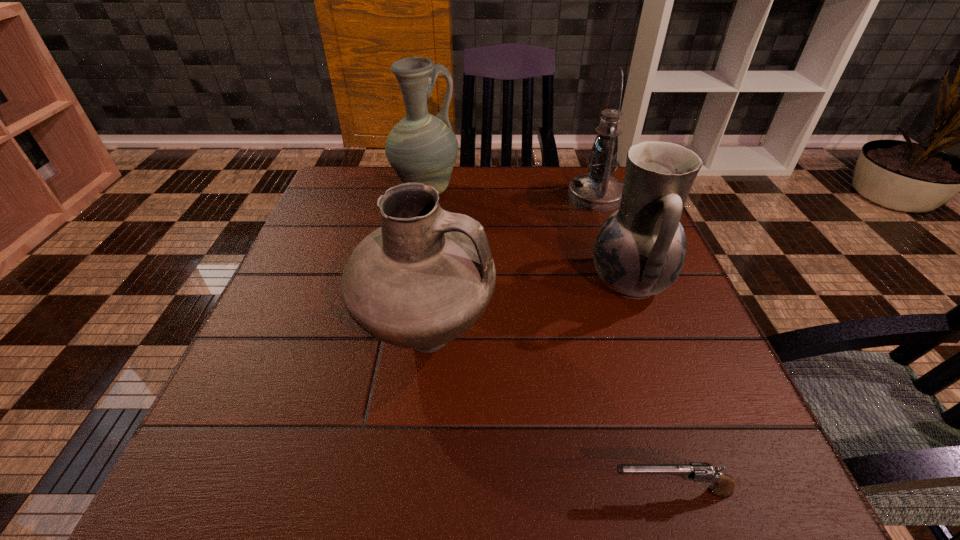
Locate an element on the screen. free space between the oil lamp and the farthest pitcher is located at coordinates (511, 194).

The width and height of the screenshot is (960, 540). In order to click on object that is the second closest to the farthest pitcher in this screenshot , I will do `click(421, 280)`.

You are a GUI agent. You are given a task and a screenshot of the screen. Output one action in this format:
    pyautogui.click(x=<x>, y=<y>)
    Task: Click on the second closest object relative to the farthest pitcher
    
    Given the screenshot: What is the action you would take?
    pyautogui.click(x=421, y=280)

Select which pitcher is the closest to the rightmost pitcher. Please provide its 2D coordinates. Your answer should be formatted as a tuple, i.e. [(x, y)], where the tuple contains the x and y coordinates of a point satisfying the conditions above.

[(421, 280)]

Identify the location of pitcher that is the second closest to the oil lamp. (421, 148).

Where is `vacant space that satisfies the following two spatial constraints: 1. on the handle side of the oil lamp; 2. on the left side of the farthest pitcher`? Image resolution: width=960 pixels, height=540 pixels. vacant space that satisfies the following two spatial constraints: 1. on the handle side of the oil lamp; 2. on the left side of the farthest pitcher is located at coordinates coord(425,196).